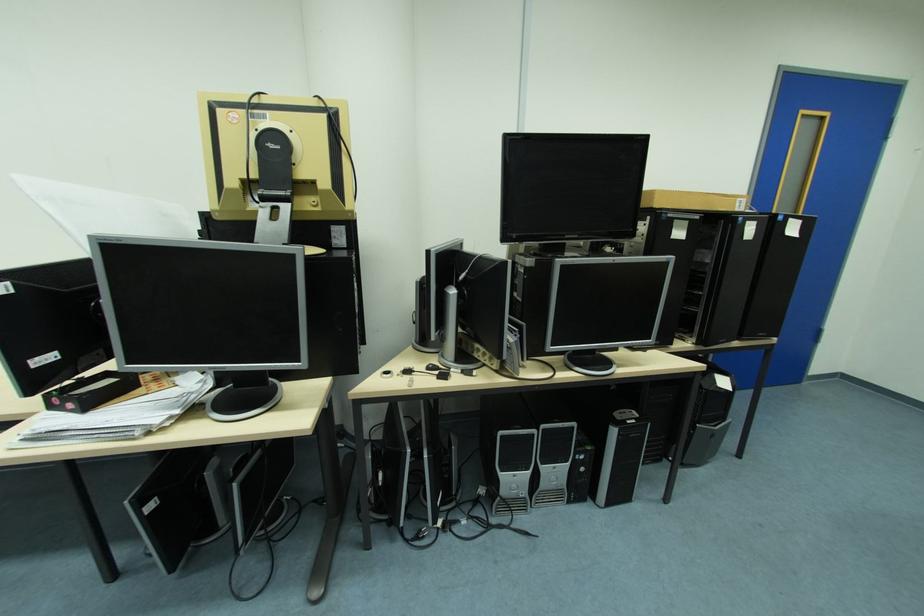
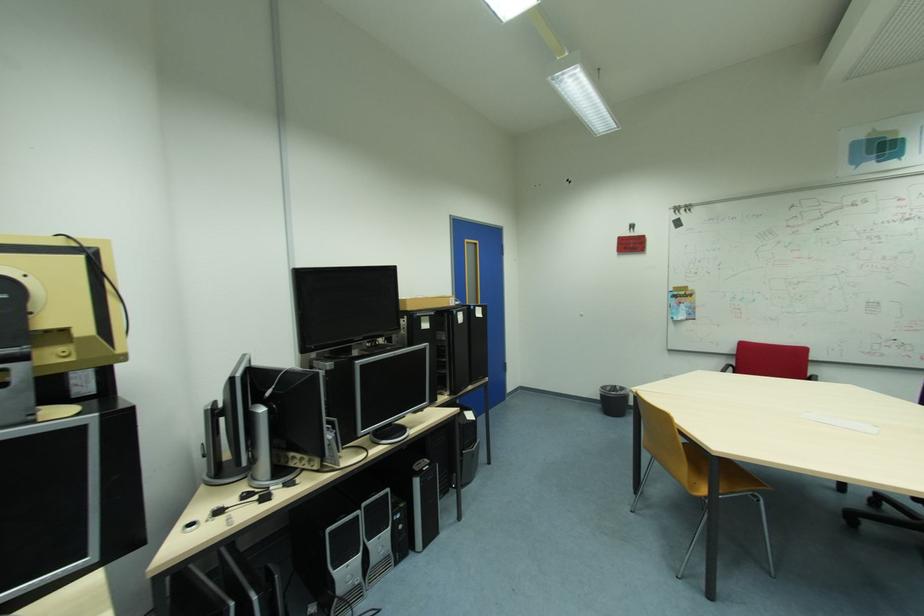
The point at (687, 235) is marked in the first image. Where is the corresponding point in the second image?

(432, 326)